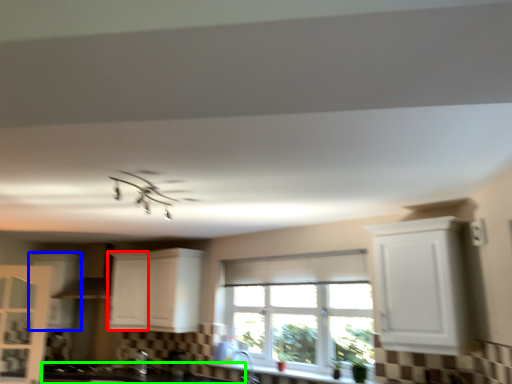
Question: Based on their relative distances, which object is nearer to cabinetry (highlighted by a red box)? Choose from cabinetry (highlighted by a blue box) and countertop (highlighted by a green box).

Choices:
 (A) cabinetry
 (B) countertop

Answer: (A)